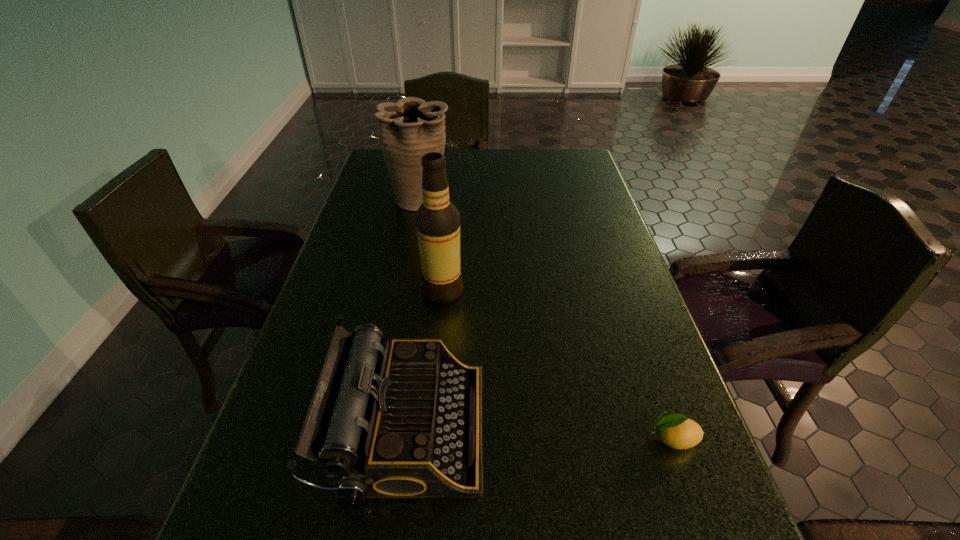
Locate an element on the screen. This screenshot has height=540, width=960. unoccupied area between the typewriter and the rightmost object is located at coordinates [540, 433].

Where is `blank region between the lemon and the third tallest object`? This screenshot has width=960, height=540. blank region between the lemon and the third tallest object is located at coordinates (540, 433).

In order to click on free spot between the second tallest object and the third tallest object in this screenshot , I will do `click(414, 313)`.

Locate an element on the screen. Image resolution: width=960 pixels, height=540 pixels. vacant area between the typewriter and the urn is located at coordinates (414, 313).

This screenshot has width=960, height=540. In order to click on free space between the tallest object and the shortest object in this screenshot , I will do `click(558, 364)`.

This screenshot has height=540, width=960. What are the coordinates of `vacant space that's between the third tallest object and the second tallest object` in the screenshot? It's located at (414, 313).

At what (x,y) coordinates should I click in order to perform the action: click on vacant area that lies between the second tallest object and the second shortest object. Please return your answer as a coordinate pair (x, y). The image size is (960, 540). Looking at the image, I should click on (414, 313).

You are a GUI agent. You are given a task and a screenshot of the screen. Output one action in this format:
    pyautogui.click(x=<x>, y=<y>)
    Task: Click on the object that stands as the second closest to the third nearest object
    
    Given the screenshot: What is the action you would take?
    pyautogui.click(x=410, y=128)

I want to click on object that is the closest to the third shortest object, so coord(437,220).